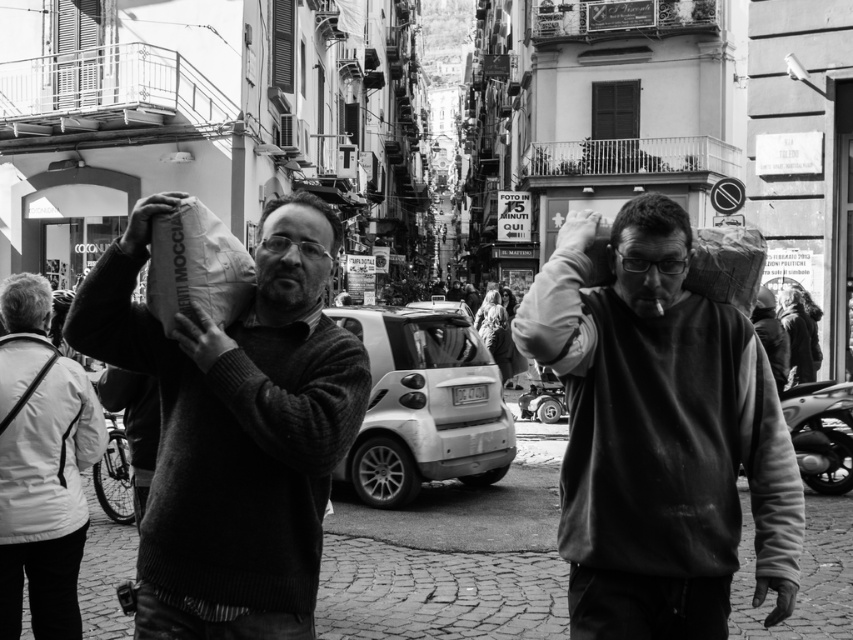
Question: Estimate the real-world distances between objects in this image. Which object is farther from the smooth gray hair at upper left?

Choices:
 (A) matte black head at center
 (B) smooth skin head at center
 (C) white fabric bag at left
 (D) knitted sweater at center

Answer: (A)

Question: Does white fabric bag at left appear on the left side of smooth gray hair at upper left?

Choices:
 (A) yes
 (B) no

Answer: (B)

Question: Among these points, which one is farthest from the camera?

Choices:
 (A) (44, 524)
 (B) (12, 323)
 (C) (337, 236)

Answer: (B)

Question: Which is farther from the white fabric bag at left?

Choices:
 (A) matte black head at center
 (B) smooth gray hair at upper left
 (C) matte gray sweater at center
 (D) knitted sweater at center

Answer: (A)

Question: Is matte gray sweater at center to the left of matte black head at center from the viewer's perspective?

Choices:
 (A) no
 (B) yes

Answer: (B)

Question: Is knitted sweater at center closer to the viewer compared to smooth skin head at center?

Choices:
 (A) yes
 (B) no

Answer: (A)